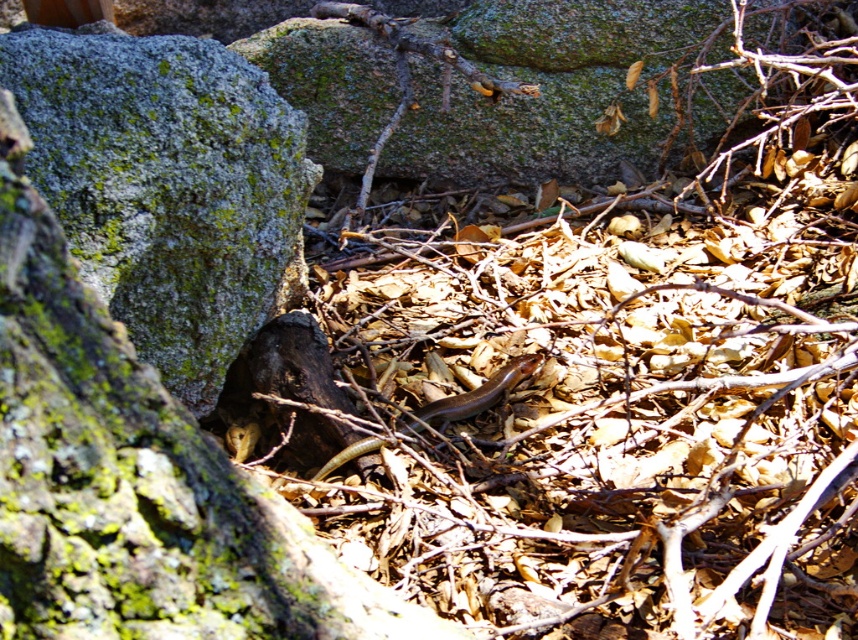
Is green mossy rock at center-left above brown matte snake at center?

Indeed, green mossy rock at center-left is positioned over brown matte snake at center.

Between green mossy rock at center-left and brown matte snake at center, which one is positioned lower?

brown matte snake at center is below.

Between point (154, 182) and point (463, 400), which one is positioned in front?

Point (154, 182)

What are the coordinates of `green mossy rock at center-left` in the screenshot? It's located at (167, 188).